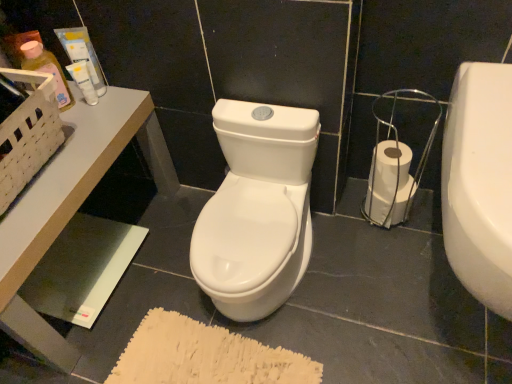
Question: Can you confirm if white glossy table at upper left is positioned to the right of matte plastic tube at upper left, the second toiletry when ordered from right to left?

Choices:
 (A) no
 (B) yes

Answer: (A)

Question: Does white glossy table at upper left have a greater height compared to matte plastic tube at upper left, which ranks as the second toiletry in left-to-right order?

Choices:
 (A) no
 (B) yes

Answer: (B)

Question: Is white glossy table at upper left in front of matte plastic tube at upper left, the second toiletry when ordered from right to left?

Choices:
 (A) no
 (B) yes

Answer: (B)

Question: Are white glossy table at upper left and matte plastic tube at upper left, the second toiletry when ordered from right to left, located far from each other?

Choices:
 (A) no
 (B) yes

Answer: (A)

Question: Can matte plastic tube at upper left, the second toiletry when ordered from right to left, be found inside white glossy table at upper left?

Choices:
 (A) no
 (B) yes

Answer: (A)

Question: Can you confirm if white glossy table at upper left is shorter than matte plastic tube at upper left, which ranks as the second toiletry in left-to-right order?

Choices:
 (A) no
 (B) yes

Answer: (A)

Question: Considering the relative sizes of white glossy toilet paper at lower right and white glossy table at upper left in the image provided, is white glossy toilet paper at lower right thinner than white glossy table at upper left?

Choices:
 (A) no
 (B) yes

Answer: (B)

Question: Can you confirm if white glossy toilet paper at lower right is wider than white glossy table at upper left?

Choices:
 (A) no
 (B) yes

Answer: (A)

Question: Is white glossy toilet paper at lower right aimed at white glossy table at upper left?

Choices:
 (A) no
 (B) yes

Answer: (A)

Question: Is white glossy toilet paper at lower right far away from white glossy table at upper left?

Choices:
 (A) yes
 (B) no

Answer: (B)

Question: From a real-world perspective, is white glossy toilet paper at lower right beneath white glossy table at upper left?

Choices:
 (A) yes
 (B) no

Answer: (A)

Question: Are white glossy toilet paper at lower right and white glossy table at upper left beside each other?

Choices:
 (A) yes
 (B) no

Answer: (B)

Question: Does white glossy table at upper left have a larger size compared to translucent plastic bottle at upper left, acting as the third toiletry starting from the right?

Choices:
 (A) no
 (B) yes

Answer: (B)